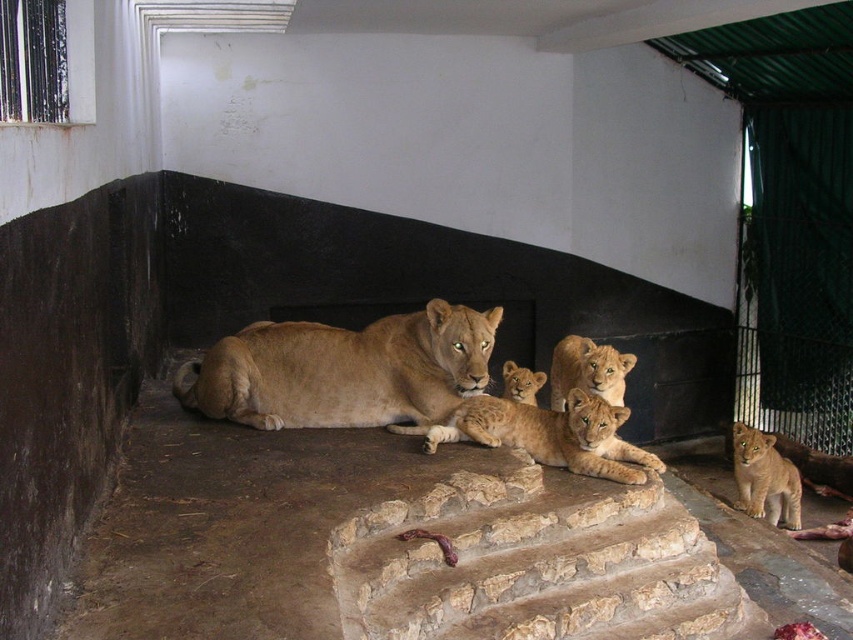
Question: Based on their relative distances, which object is farther from the golden fur lion at center?

Choices:
 (A) golden fur lion cubs at center
 (B) golden fur cub at lower right

Answer: (B)

Question: Can you confirm if golden fur lion cubs at center is smaller than golden fur cub at center?

Choices:
 (A) no
 (B) yes

Answer: (A)

Question: Which of the following is the closest to the observer?

Choices:
 (A) (575, 454)
 (B) (756, 465)
 (C) (453, 339)

Answer: (A)

Question: Does golden fur lion cub at center have a larger size compared to golden fur cub at center?

Choices:
 (A) no
 (B) yes

Answer: (B)

Question: Does golden fur lion cubs at center appear on the left side of golden fur lion cub at center?

Choices:
 (A) yes
 (B) no

Answer: (A)

Question: Which object is farther from the camera taking this photo?

Choices:
 (A) golden fur lion cubs at center
 (B) golden fur cub at center

Answer: (B)